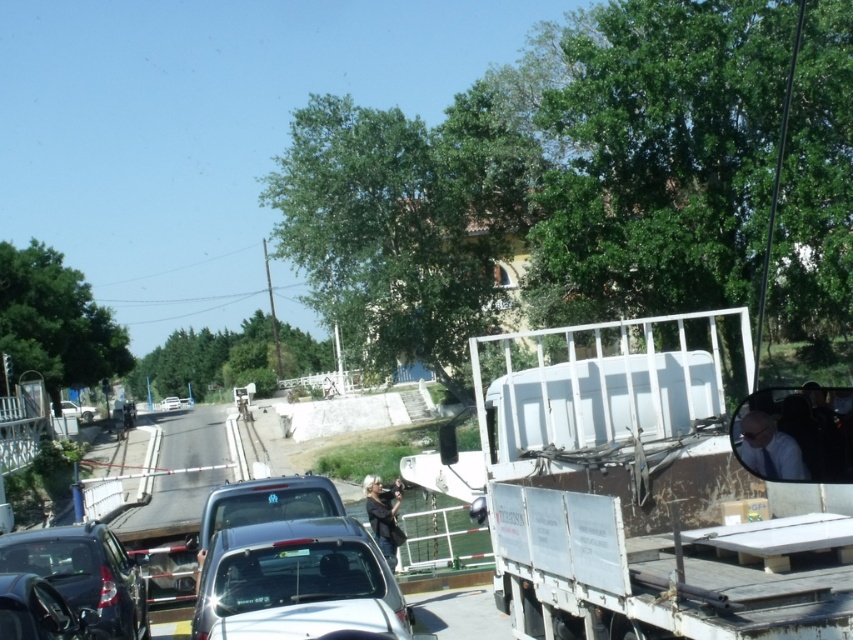
Question: Is shiny black sedan at center bigger than dark gray fabric jacket at center?

Choices:
 (A) no
 (B) yes

Answer: (A)

Question: Which object is positioned farthest from the shiny black sedan at center?

Choices:
 (A) white matte trailer truck at right
 (B) dark gray fabric jacket at center
 (C) dark blue shirt at center
 (D) shiny black sedan at lower left

Answer: (B)

Question: Is shiny black sedan at lower left below dark gray fabric jacket at center?

Choices:
 (A) no
 (B) yes

Answer: (A)

Question: Is the position of shiny black car at lower left less distant than that of dark blue shirt at center?

Choices:
 (A) yes
 (B) no

Answer: (B)

Question: Which of the following is the farthest from the observer?

Choices:
 (A) shiny black car at lower left
 (B) shiny black sedan at center
 (C) metallic silver car at center

Answer: (C)

Question: Which point is farther to the camera?

Choices:
 (A) (173, 403)
 (B) (126, 609)
 (C) (36, 593)
 (D) (796, 465)

Answer: (A)